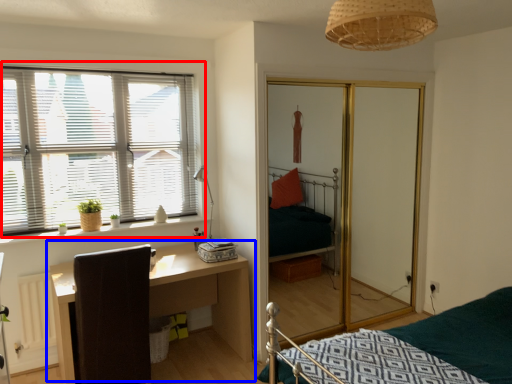
Question: Which point is further to the camera, window (highlighted by a red box) or table (highlighted by a blue box)?

Choices:
 (A) window
 (B) table

Answer: (A)